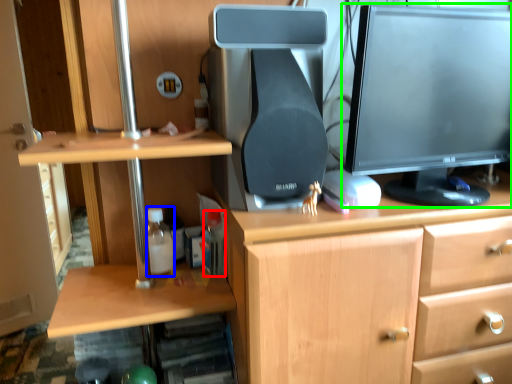
Question: Considering the real-world distances, which object is closest to bottle (highlighted by a red box)? bottle (highlighted by a blue box) or computer monitor (highlighted by a green box).

Choices:
 (A) bottle
 (B) computer monitor

Answer: (A)